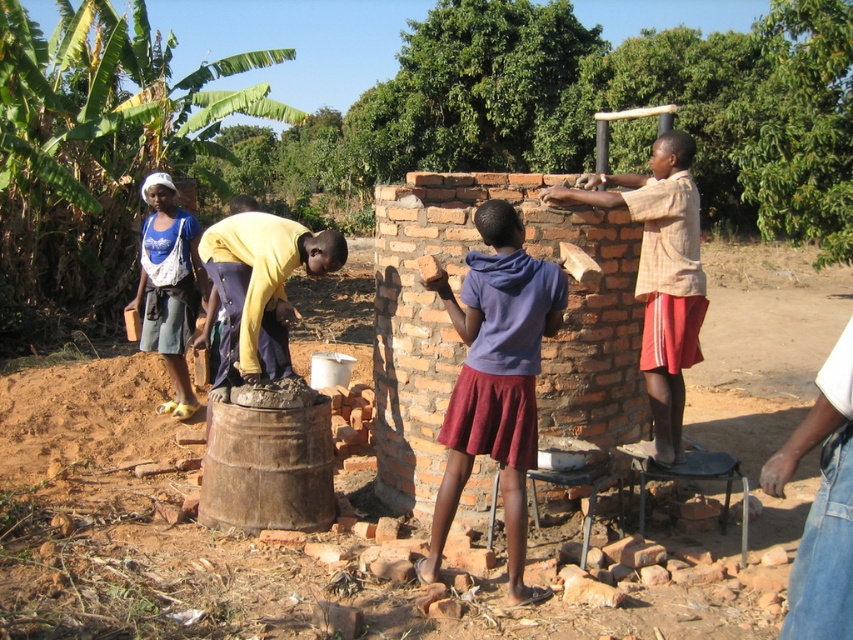
You are standing in front of the brick structure and want to know which of the two points, point (277, 236) or point (189, 282), is closer to you. Can you determine this based on their positions?

Point (277, 236) is closer to the camera than point (189, 282), so it is closer to you.

You are a fashion designer observing the scene and notice the purple matte skirt at center and the denim shorts at left. Which clothing item is shorter in height?

The purple matte skirt at center is not as tall as the denim shorts at left, so the purple matte skirt at center is shorter in height.

You are standing at the center of the brick structure and want to locate the plaid shirt at right. In which direction should you look to see it?

The plaid shirt at right is located at the right side of the scene, so you should look to your right to see it.